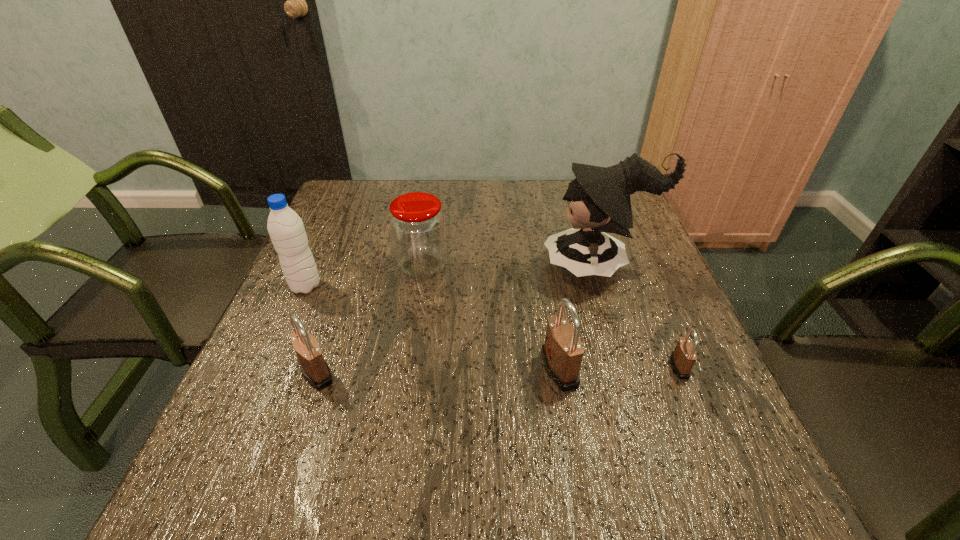
Image resolution: width=960 pixels, height=540 pixels. I want to click on doll located at the right edge, so click(598, 198).

You are a GUI agent. You are given a task and a screenshot of the screen. Output one action in this format:
    pyautogui.click(x=<x>, y=<y>)
    Task: Click on the vacant space at the far edge
    Image resolution: width=960 pixels, height=540 pixels.
    Given the screenshot: What is the action you would take?
    pyautogui.click(x=448, y=183)

Where is `vacant space at the near edge of the desktop`? The width and height of the screenshot is (960, 540). vacant space at the near edge of the desktop is located at coordinates (539, 413).

At what (x,y) coordinates should I click in order to perform the action: click on free space at the left edge. Please return your answer as a coordinate pair (x, y). Looking at the image, I should click on (348, 248).

Where is `vacant space at the right edge`? The height and width of the screenshot is (540, 960). vacant space at the right edge is located at coordinates (665, 294).

Find the location of a particular element. Image resolution: width=960 pixels, height=540 pixels. vacant space at the far left corner of the desktop is located at coordinates (355, 208).

Identify the location of free space between the rightmost padlock and the tallest object. Image resolution: width=960 pixels, height=540 pixels. (639, 316).

This screenshot has height=540, width=960. In order to click on free space between the shortest padlock and the leftmost object in this screenshot , I will do `click(492, 326)`.

At what (x,y) coordinates should I click in order to perform the action: click on vacant area between the leftmost object and the doll. Please return your answer as a coordinate pair (x, y). Looking at the image, I should click on (452, 275).

Identify the location of free space between the second padlock from left to right and the rightmost padlock. This screenshot has height=540, width=960. (619, 368).